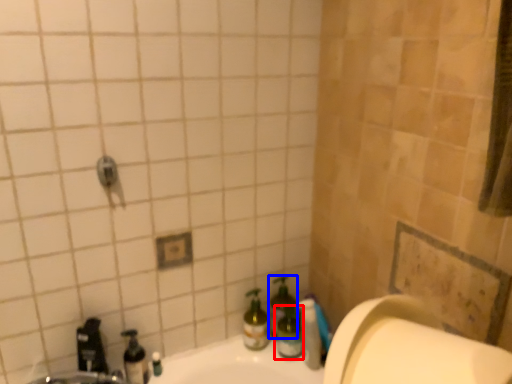
Question: Which of the following is the farthest to the observer, bottle (highlighted by a red box) or bottle (highlighted by a blue box)?

Choices:
 (A) bottle
 (B) bottle

Answer: (B)